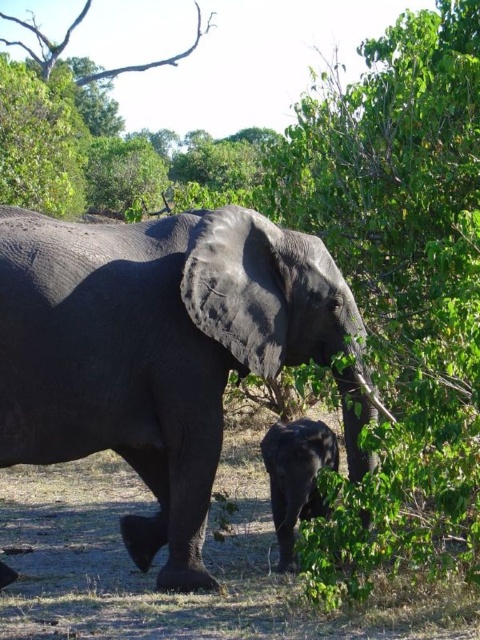
Can you confirm if brown dry grass at lower center is positioned to the right of dark gray elephant at lower center?

No, brown dry grass at lower center is not to the right of dark gray elephant at lower center.

Does point (274, 618) lie behind point (289, 442)?

No.

Find the location of a particular element. brown dry grass at lower center is located at coordinates (164, 557).

Which of these two, gray textured elephant at center or brown dry grass at lower center, stands shorter?

brown dry grass at lower center is shorter.

Measure the distance between gray textured elephant at center and brown dry grass at lower center.

5.43 feet

Where is `gray textured elephant at center`? This screenshot has width=480, height=640. gray textured elephant at center is located at coordinates (160, 352).

Is gray textured elephant at center positioned at the back of dark gray elephant at lower center?

No, gray textured elephant at center is in front of dark gray elephant at lower center.

Measure the distance between gray textured elephant at center and dark gray elephant at lower center.

gray textured elephant at center and dark gray elephant at lower center are 3.30 feet apart.

Is point (181, 413) positioned behind point (289, 460)?

No, it is in front of (289, 460).

Find the location of a particular element. The width and height of the screenshot is (480, 640). gray textured elephant at center is located at coordinates (160, 352).